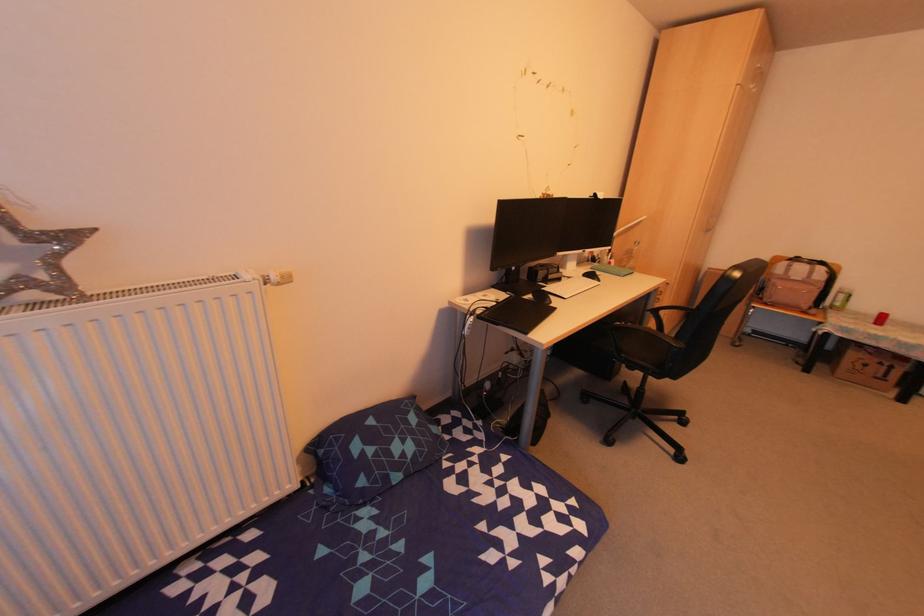
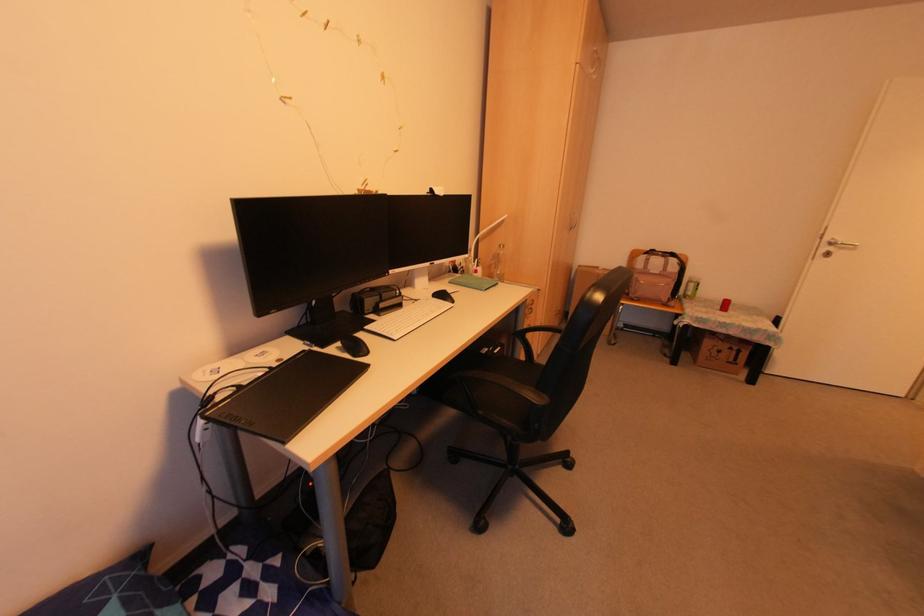
Find the pixel in the second image that matches (548,302) in the first image.

(365, 353)